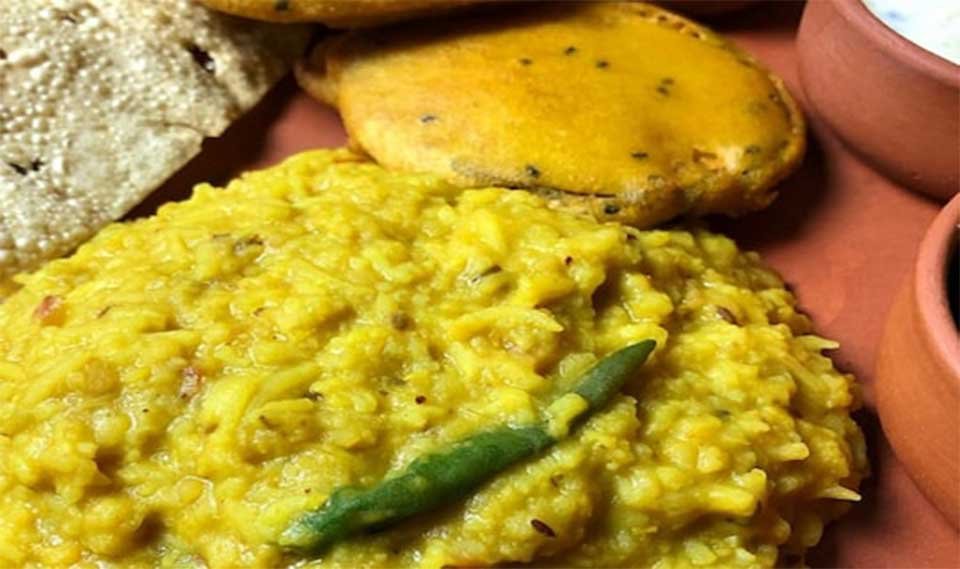
You are a GUI agent. You are given a task and a screenshot of the screen. Output one action in this format:
    pyautogui.click(x=<x>, y=<y>)
    Task: Click on the clay bowls
    The width and height of the screenshot is (960, 569).
    Given the screenshot: What is the action you would take?
    pyautogui.click(x=874, y=123), pyautogui.click(x=916, y=372)